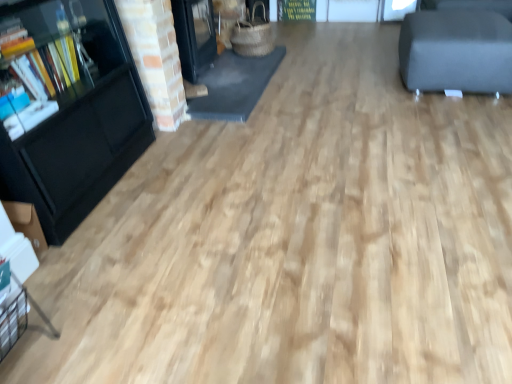
Question: Considering the relative positions of dark gray fabric ottoman at upper right and black glossy bookcase at left in the image provided, is dark gray fabric ottoman at upper right to the left or to the right of black glossy bookcase at left?

Choices:
 (A) right
 (B) left

Answer: (A)

Question: Is dark gray fabric ottoman at upper right taller or shorter than black glossy bookcase at left?

Choices:
 (A) short
 (B) tall

Answer: (A)

Question: From the image's perspective, is dark gray fabric ottoman at upper right above or below black glossy bookcase at left?

Choices:
 (A) below
 (B) above

Answer: (B)

Question: From their relative heights in the image, would you say black glossy bookcase at left is taller or shorter than dark gray fabric ottoman at upper right?

Choices:
 (A) tall
 (B) short

Answer: (A)

Question: In terms of width, does black glossy bookcase at left look wider or thinner when compared to dark gray fabric ottoman at upper right?

Choices:
 (A) wide
 (B) thin

Answer: (B)

Question: From a real-world perspective, relative to dark gray fabric ottoman at upper right, is black glossy bookcase at left vertically above or below?

Choices:
 (A) above
 (B) below

Answer: (A)

Question: Is black glossy bookcase at left bigger or smaller than dark gray fabric ottoman at upper right?

Choices:
 (A) small
 (B) big

Answer: (B)